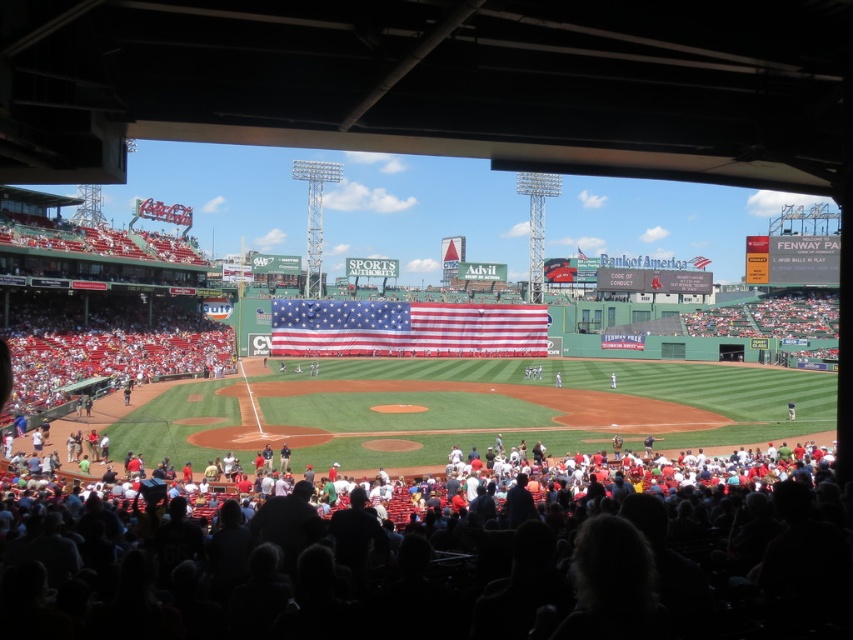
Question: Does american flag at center appear under white plastic scoreboard at upper right?

Choices:
 (A) yes
 (B) no

Answer: (A)

Question: Is the position of dark hair at lower center less distant than that of white plastic scoreboard at upper right?

Choices:
 (A) no
 (B) yes

Answer: (B)

Question: Considering the real-world distances, which object is closest to the dark hair at lower center?

Choices:
 (A) american flag at center
 (B) white plastic scoreboard at upper right

Answer: (A)

Question: Which point is closer to the camera?

Choices:
 (A) dark hair at lower center
 (B) american flag at center

Answer: (A)

Question: Can you confirm if dark hair at lower center is positioned below american flag at center?

Choices:
 (A) no
 (B) yes

Answer: (B)

Question: Which of the following is the closest to the observer?

Choices:
 (A) (770, 275)
 (B) (281, 310)
 (C) (714, 467)

Answer: (C)